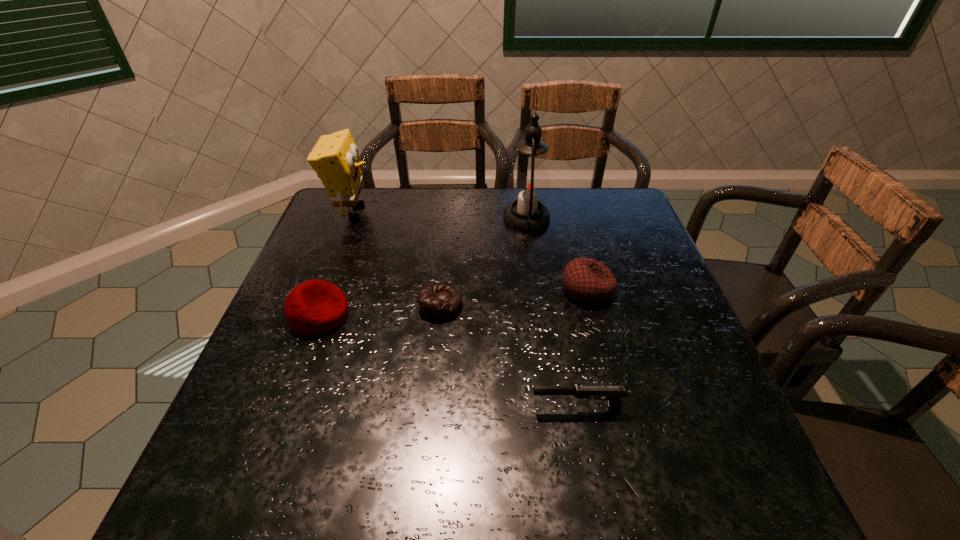
You are a GUI agent. You are given a task and a screenshot of the screen. Output one action in this format:
    pyautogui.click(x=<x>, y=<y>)
    Task: Click on the vacant region between the oil lamp and the fifth shortest object
    The image size is (960, 540).
    Given the screenshot: What is the action you would take?
    pyautogui.click(x=440, y=215)

Where is `vacant space in between the leftmost beanbag and the shortest beanbag`? vacant space in between the leftmost beanbag and the shortest beanbag is located at coordinates (380, 310).

At what (x,y) coordinates should I click in order to perform the action: click on free spot between the sponge and the tallest object. Please return your answer as a coordinate pair (x, y). The height and width of the screenshot is (540, 960). Looking at the image, I should click on (440, 215).

Locate an element on the screen. empty location between the leftmost beanbag and the shortest object is located at coordinates (380, 310).

Locate an element on the screen. the fifth closest object to the shortest beanbag is located at coordinates (335, 158).

This screenshot has height=540, width=960. I want to click on object identified as the second closest to the tallest object, so click(x=438, y=302).

The width and height of the screenshot is (960, 540). Identify the location of beanbag that is the second closest one to the leftmost beanbag. (586, 280).

Identify which beanbag is located as the second nearest to the tallest object. Please provide its 2D coordinates. Your answer should be formatted as a tuple, i.e. [(x, y)], where the tuple contains the x and y coordinates of a point satisfying the conditions above.

[(438, 302)]

What are the coordinates of `free point that satisfies the following two spatial constraints: 1. on the face of the shortest beanbag; 2. on the right side of the sponge` in the screenshot? It's located at (317, 305).

Locate an element on the screen. The width and height of the screenshot is (960, 540). free space that satisfies the following two spatial constraints: 1. on the face of the sponge; 2. on the back side of the shortest object is located at coordinates (317, 305).